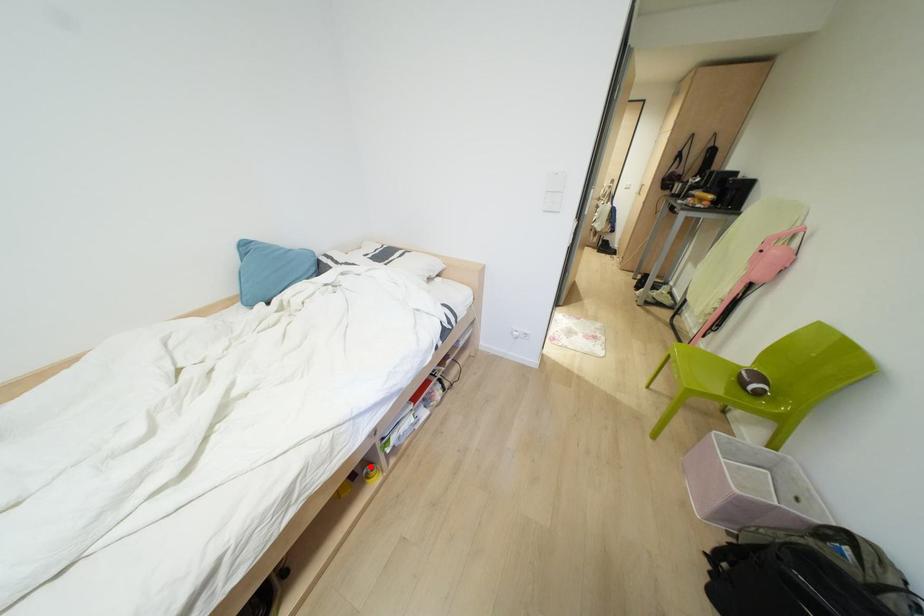
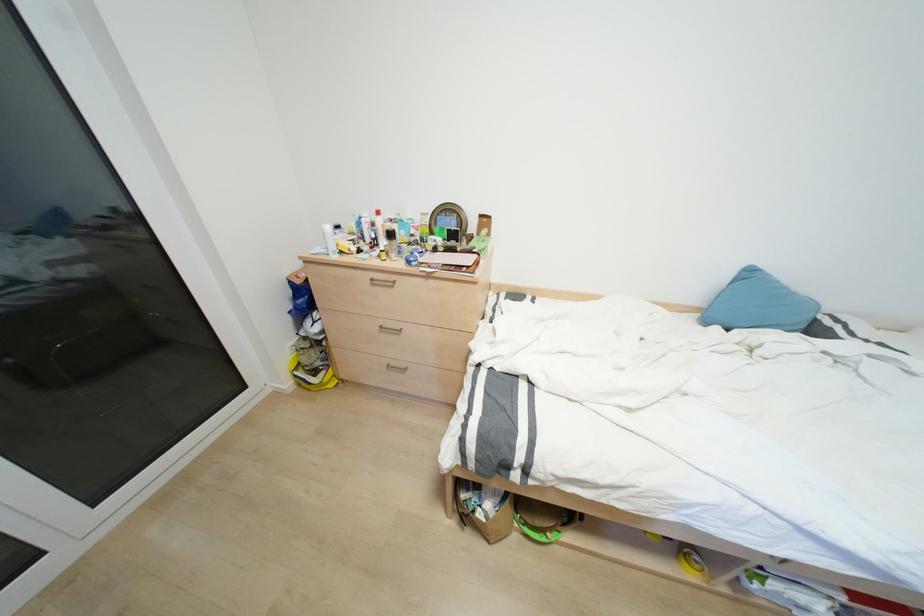
Locate, in the second image, the point that corresponds to the highlighted location in the first image.

(696, 557)